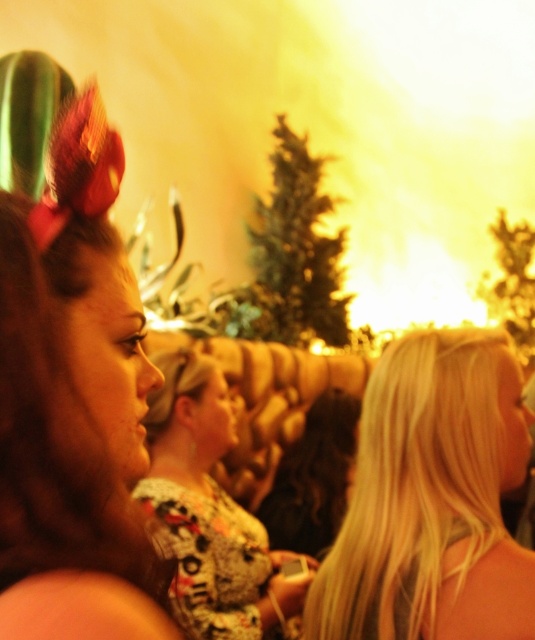
Is blonde hair at right behind dark curly hair at center?

No, blonde hair at right is in front of dark curly hair at center.

Does blonde hair at right appear under dark curly hair at center?

No, blonde hair at right is not below dark curly hair at center.

Describe the element at coordinates (432, 499) in the screenshot. I see `blonde hair at right` at that location.

Locate an element on the screen. blonde hair at right is located at coordinates (432, 499).

Who is more distant from viewer, (351, 628) or (157, 509)?

The point (157, 509) is behind.

Is blonde hair at right positioned at the back of floral-patterned shirt at center?

That is False.

Identify the location of blonde hair at right. (432, 499).

Does brown shiny hair at left appear on the left side of blonde hair at right?

Indeed, brown shiny hair at left is positioned on the left side of blonde hair at right.

Is brown shiny hair at left to the right of blonde hair at right from the viewer's perspective?

Incorrect, brown shiny hair at left is not on the right side of blonde hair at right.

The width and height of the screenshot is (535, 640). What are the coordinates of `brown shiny hair at left` in the screenshot? It's located at (68, 444).

This screenshot has height=640, width=535. Find the location of `brown shiny hair at left`. brown shiny hair at left is located at coordinates (68, 444).